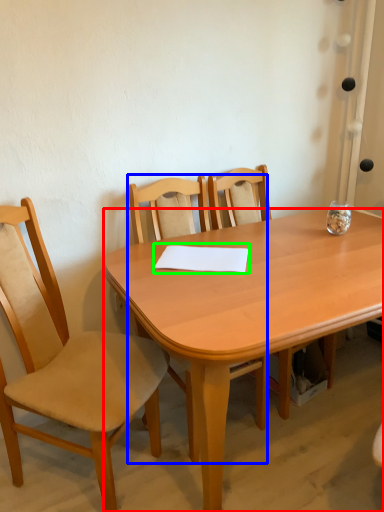
Question: Estimate the real-world distances between objects in this image. Which object is farther from desk (highlighted by a red box), chair (highlighted by a blue box) or notepad (highlighted by a green box)?

Choices:
 (A) chair
 (B) notepad

Answer: (A)